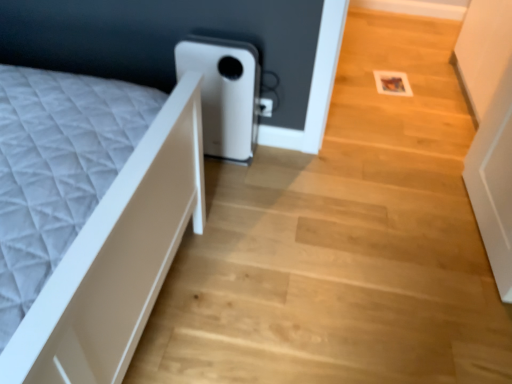
You are a GUI agent. You are given a task and a screenshot of the screen. Output one action in this format:
    pyautogui.click(x=<x>, y=<y>)
    Task: Click on the vacant space in front of white matte water heater at center
    The width and height of the screenshot is (512, 384).
    Given the screenshot: What is the action you would take?
    pyautogui.click(x=231, y=181)